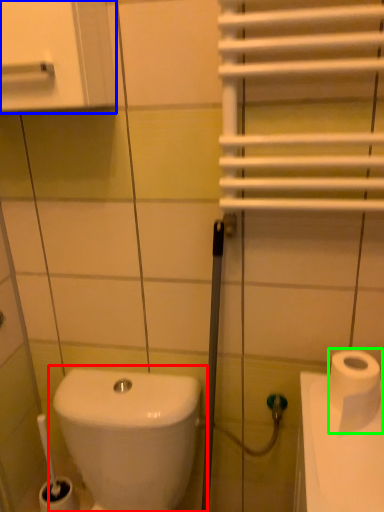
Question: Which is nearer to the toilet (highlighted by a red box)? medicine cabinet (highlighted by a blue box) or toilet paper (highlighted by a green box).

Choices:
 (A) medicine cabinet
 (B) toilet paper

Answer: (B)